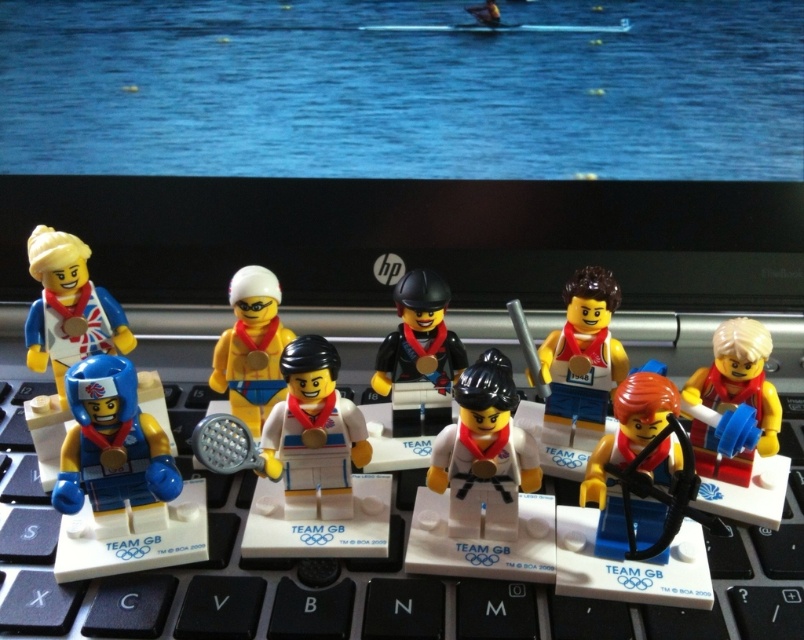
Question: Which of the following is the closest to the observer?

Choices:
 (A) shiny orange helmet at center
 (B) white matte tennis racket at center
 (C) matte yellow minifigure at center

Answer: (A)

Question: Considering the real-world distances, which object is farthest from the white matte tennis racket at center?

Choices:
 (A) shiny orange helmet at center
 (B) yellow matte tennis racket at center

Answer: (A)

Question: Can you confirm if black plastic keyboard at center is positioned below black matte horse at center?

Choices:
 (A) no
 (B) yes

Answer: (B)

Question: Where is white matte tennis racket at center located in relation to matte yellow minifigure at center in the image?

Choices:
 (A) left
 (B) right

Answer: (A)

Question: Can you confirm if black plastic keyboard at center is positioned below white matte karate figure at center?

Choices:
 (A) yes
 (B) no

Answer: (A)

Question: Among these objects, which one is farthest from the camera?

Choices:
 (A) yellow matte tennis racket at center
 (B) black plastic keyboard at center

Answer: (A)